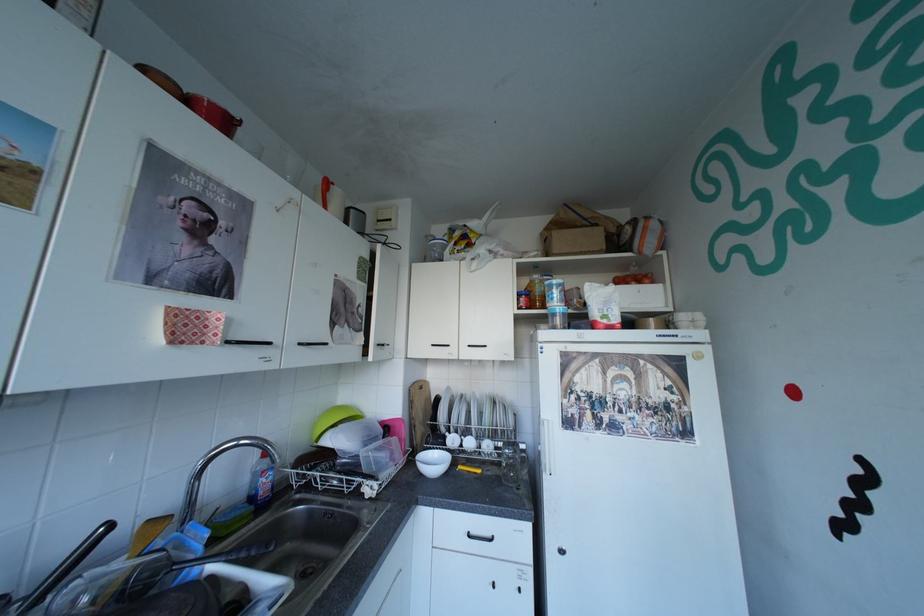
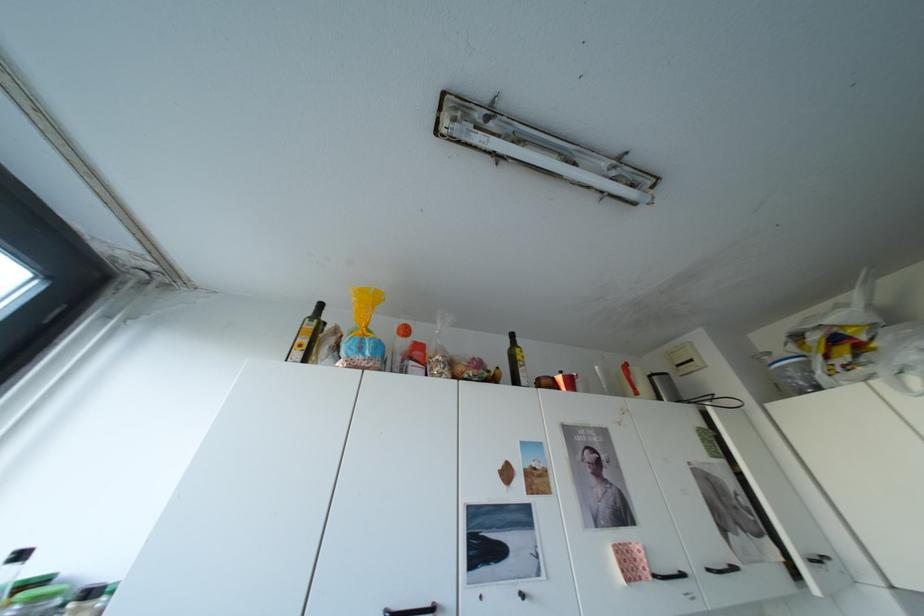
Where in the second image is the point corresponding to [468,244] from the first image?

(840, 357)